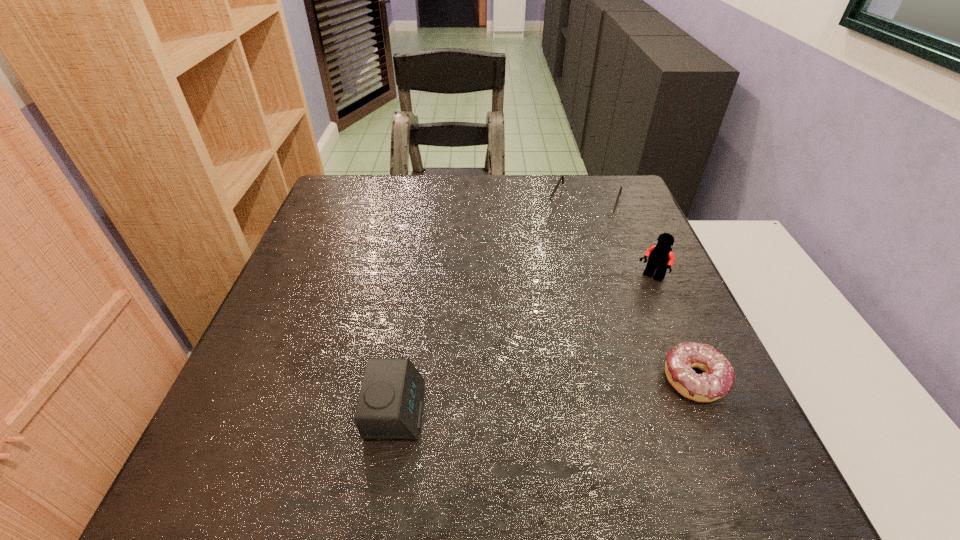
The image size is (960, 540). I want to click on object that is at the far right corner, so click(x=595, y=215).

Locate an element on the screen. The width and height of the screenshot is (960, 540). object that is positioned at the near right corner is located at coordinates (718, 379).

The width and height of the screenshot is (960, 540). In the image, there is a desktop. What are the coordinates of `vacant space at the far edge` in the screenshot? It's located at (487, 208).

In the image, there is a desktop. Identify the location of free space at the near edge. (436, 415).

Find the location of a particular element. free region at the left edge of the desktop is located at coordinates (342, 312).

This screenshot has height=540, width=960. I want to click on vacant space at the right edge, so click(616, 224).

Locate an element on the screen. vacant space at the far left corner of the desktop is located at coordinates (370, 179).

This screenshot has height=540, width=960. Identify the location of free space at the far right corner of the desktop. (619, 216).

Image resolution: width=960 pixels, height=540 pixels. Find the location of `vacant space that is in between the third nearest object and the second tallest object`. vacant space that is in between the third nearest object and the second tallest object is located at coordinates (523, 345).

Find the location of a particular element. This screenshot has height=540, width=960. free space between the Lego and the alarm clock is located at coordinates (523, 345).